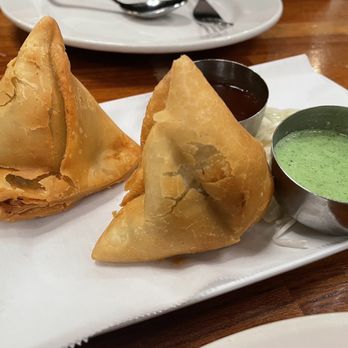
This screenshot has width=348, height=348. What are the coordinates of `white plate in the background` in the screenshot? It's located at (174, 29).